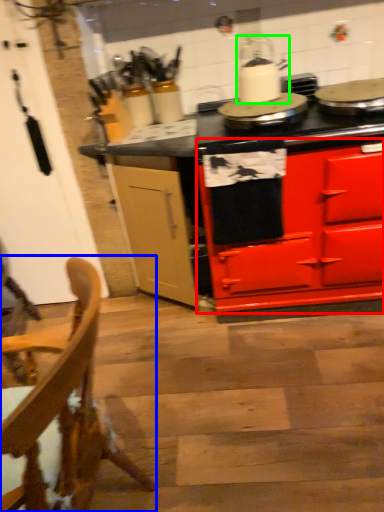
Question: Which object is positioned closest to cabinetry (highlighted by a red box)? Select from chair (highlighted by a blue box) and kitchen appliance (highlighted by a green box).

Choices:
 (A) chair
 (B) kitchen appliance

Answer: (B)